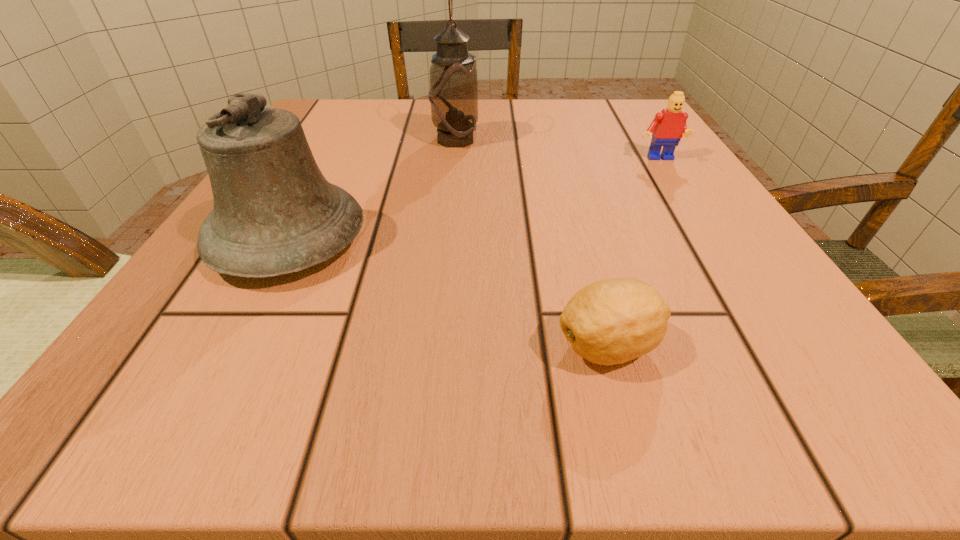
At what (x,y) coordinates should I click in order to perform the action: click on free space that satisfies the following two spatial constraints: 1. on the front-facing side of the second shortest object; 2. at the stem end of the nearest object. Please return your answer as a coordinate pair (x, y). Looking at the image, I should click on (777, 346).

Image resolution: width=960 pixels, height=540 pixels. Find the location of `free space that satisfies the following two spatial constraints: 1. on the front-facing side of the rightmost object; 2. at the stem end of the shortest object`. free space that satisfies the following two spatial constraints: 1. on the front-facing side of the rightmost object; 2. at the stem end of the shortest object is located at coordinates (777, 346).